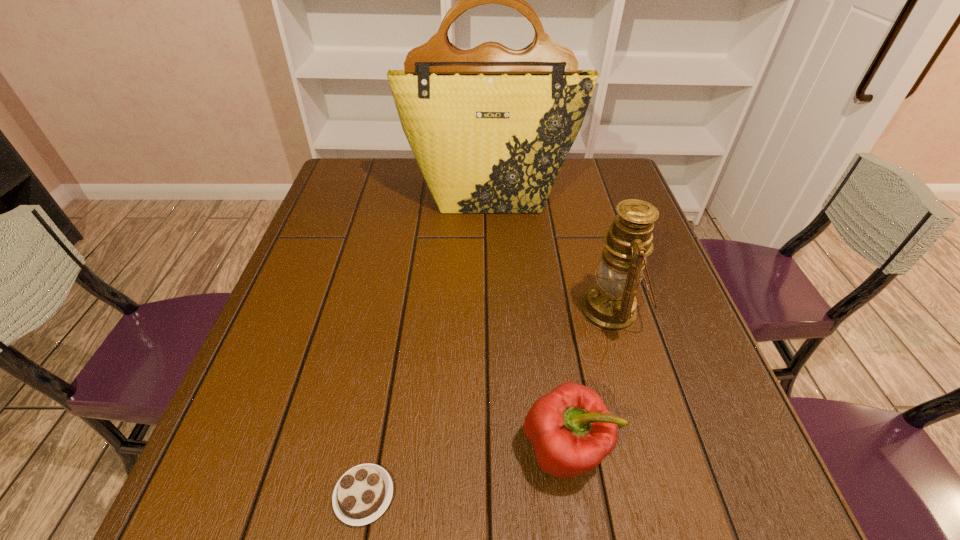
Where is `the closest object to the farthest object`? the closest object to the farthest object is located at coordinates (610, 305).

You are a GUI agent. You are given a task and a screenshot of the screen. Output one action in this format:
    pyautogui.click(x=<x>, y=<y>)
    Task: Click on the object that is the third closest one to the shortest object
    This screenshot has width=960, height=540.
    Given the screenshot: What is the action you would take?
    pyautogui.click(x=490, y=127)

This screenshot has width=960, height=540. Find the location of `vacant space that satisfies the following two spatial constraints: 1. on the back side of the chocolate cake; 2. on the right side of the second shortest object`. vacant space that satisfies the following two spatial constraints: 1. on the back side of the chocolate cake; 2. on the right side of the second shortest object is located at coordinates (372, 449).

This screenshot has height=540, width=960. I want to click on vacant space that satisfies the following two spatial constraints: 1. on the back side of the chocolate cake; 2. on the right side of the second tallest object, so click(397, 311).

Locate an element on the screen. This screenshot has width=960, height=540. vacant space that satisfies the following two spatial constraints: 1. on the front-facing side of the tallest object; 2. on the left side of the second shortest object is located at coordinates (498, 449).

Locate an element on the screen. The height and width of the screenshot is (540, 960). vacant area that satisfies the following two spatial constraints: 1. on the front-facing side of the second farthest object; 2. on the left side of the tallest object is located at coordinates (494, 311).

The height and width of the screenshot is (540, 960). I want to click on vacant space that satisfies the following two spatial constraints: 1. on the back side of the second farthest object; 2. on the left side of the third tallest object, so click(546, 311).